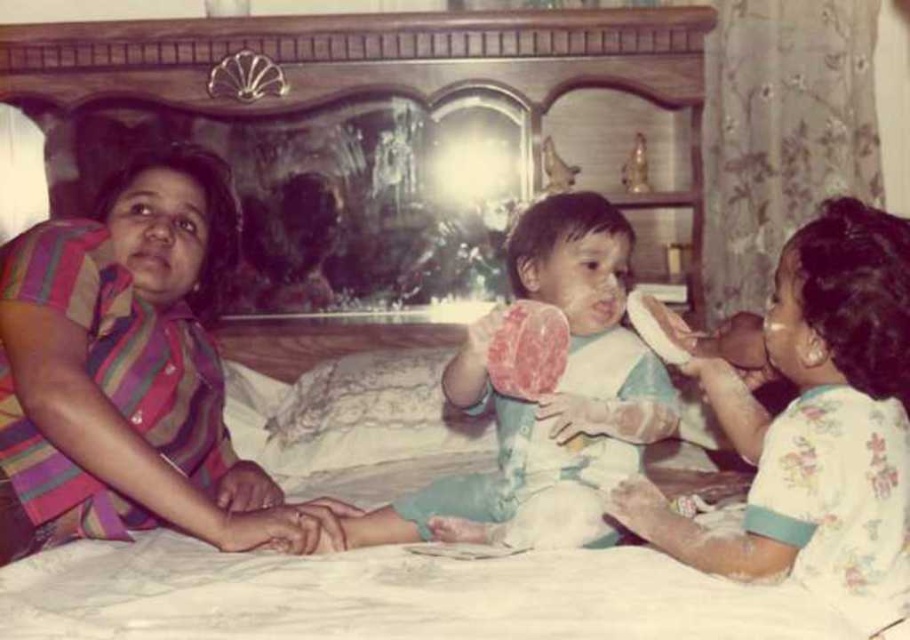
Does white cotton shirt at center appear on the right side of white cotton bib at center?

Indeed, white cotton shirt at center is positioned on the right side of white cotton bib at center.

Is the position of white cotton shirt at center more distant than that of white cotton bib at center?

No, it is in front of white cotton bib at center.

The image size is (910, 640). Identify the location of white cotton shirt at center. (814, 424).

Identify the location of white cotton shirt at center. The width and height of the screenshot is (910, 640). click(814, 424).

Is point (164, 280) in front of point (756, 451)?

No, it is not.

Does striped fabric shirt at left have a greater width compared to white cotton shirt at center?

Correct, the width of striped fabric shirt at left exceeds that of white cotton shirt at center.

Which is in front, point (143, 500) or point (870, 454)?

Point (870, 454) is in front.

This screenshot has height=640, width=910. Find the location of `striped fabric shirt at left`. striped fabric shirt at left is located at coordinates (130, 372).

Does striped fabric shirt at left have a greater height compared to white cotton bib at center?

Yes.

The width and height of the screenshot is (910, 640). What do you see at coordinates (130, 372) in the screenshot? I see `striped fabric shirt at left` at bounding box center [130, 372].

Is point (140, 524) farther from viewer compared to point (527, 422)?

No, it is in front of (527, 422).

Where is `striped fabric shirt at left`? The height and width of the screenshot is (640, 910). striped fabric shirt at left is located at coordinates (130, 372).